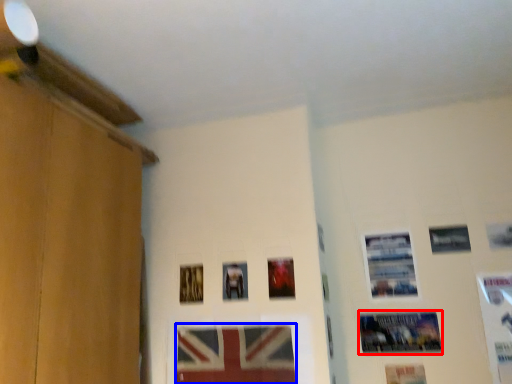
Question: Which object appears closest to the camera in this image, picture frame (highlighted by a red box) or picture frame (highlighted by a blue box)?

Choices:
 (A) picture frame
 (B) picture frame

Answer: (B)